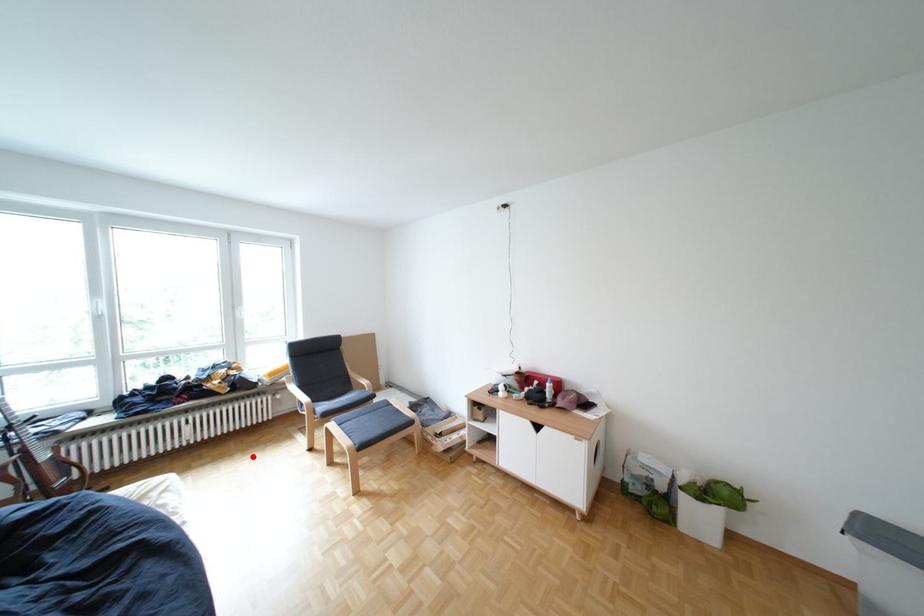
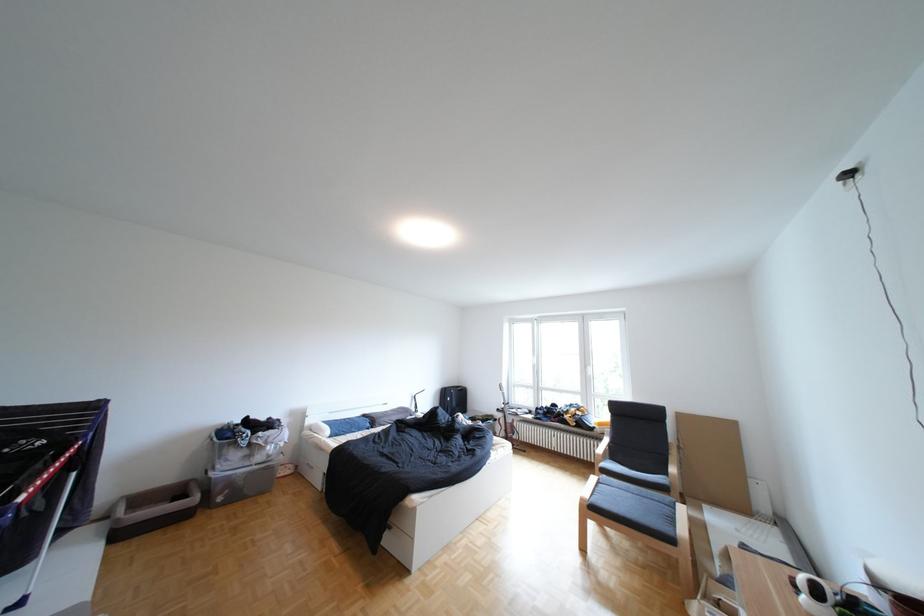
Find the pixel in the second image that matches the highlighted location in the first image.

(584, 474)